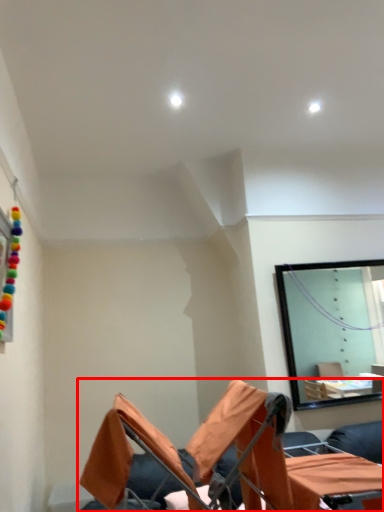
Question: From the image's perspective, what is the correct spatial positioning of furniture (annotated by the red box) in reference to table?

Choices:
 (A) below
 (B) above

Answer: (B)